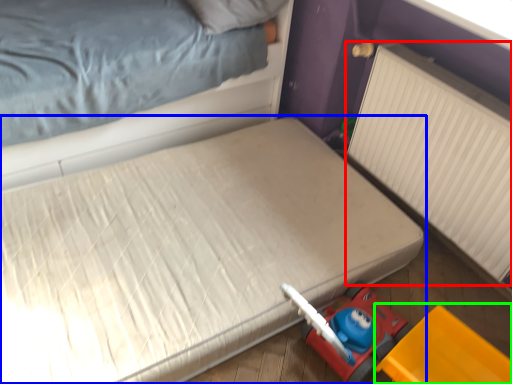
Question: Which is farther away from radiator (highlighted by a red box)? bed (highlighted by a blue box) or equipment (highlighted by a green box)?

Choices:
 (A) bed
 (B) equipment

Answer: (A)